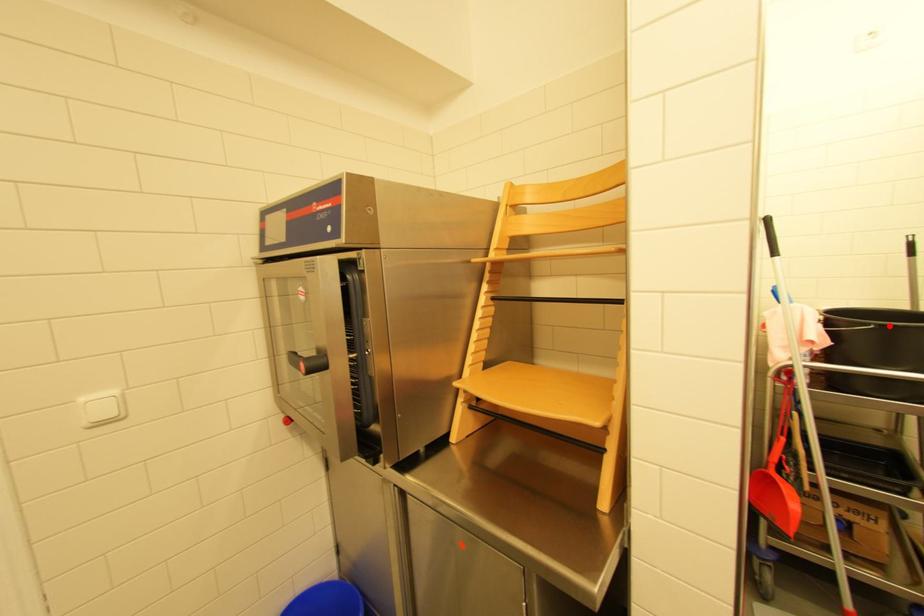
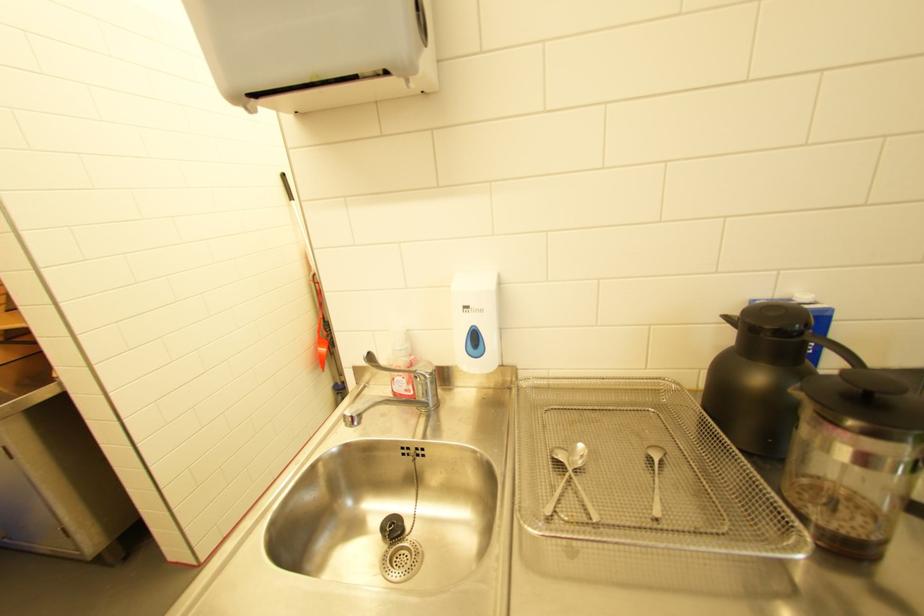
Question: I am providing you with two images of the same scene from different viewpoints. A red point is marked on the first image. At the location where the point appears in image 1, is it still visible in image 2?

Choices:
 (A) Yes
 (B) No

Answer: (B)